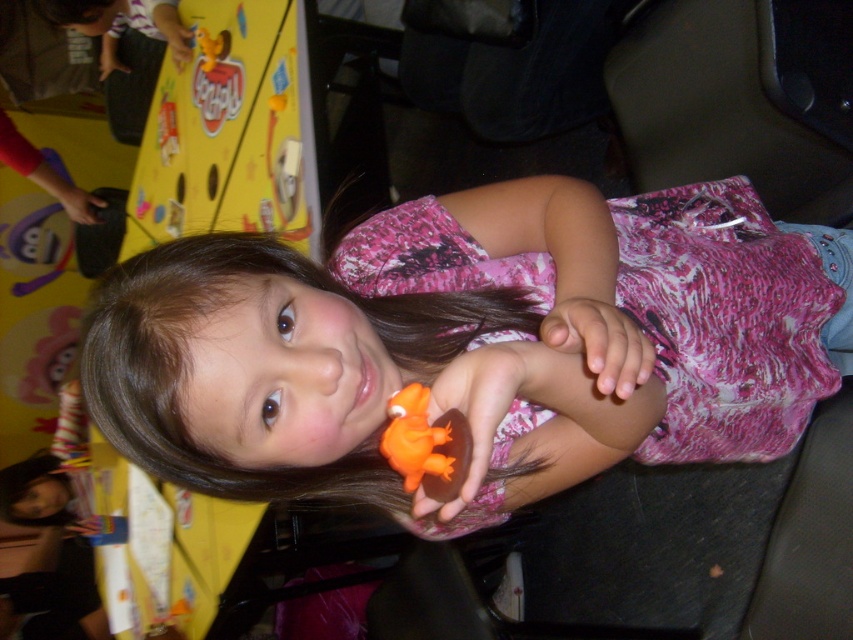
Which is below, orange rubber duck at center or orange rubber toy at center?

orange rubber duck at center is lower down.

Who is more distant from viewer, (x=494, y=348) or (x=457, y=468)?

Point (x=494, y=348)

This screenshot has width=853, height=640. Describe the element at coordinates (474, 412) in the screenshot. I see `orange rubber duck at center` at that location.

At what (x,y) coordinates should I click in order to perform the action: click on orange rubber duck at center. Please return your answer as a coordinate pair (x, y). Looking at the image, I should click on (474, 412).

Between point (502, 392) and point (82, 216), which one is positioned in front?

Point (502, 392) is more forward.

Is matte orange toy at center wider than matte black hand at upper left?

Yes.

Is point (692, 340) in front of point (79, 198)?

Yes, point (692, 340) is in front of point (79, 198).

What are the coordinates of `matte orange toy at center` in the screenshot? It's located at (467, 346).

Can you confirm if pink matte hand at center is bigger than orange rubber toy at center?

Yes, pink matte hand at center is bigger than orange rubber toy at center.

Between pink matte hand at center and orange rubber toy at center, which one has less height?

orange rubber toy at center

Between point (560, 330) and point (418, 385), which one is positioned behind?

The point (418, 385) is behind.

Locate an element on the screen. The width and height of the screenshot is (853, 640). pink matte hand at center is located at coordinates (598, 337).